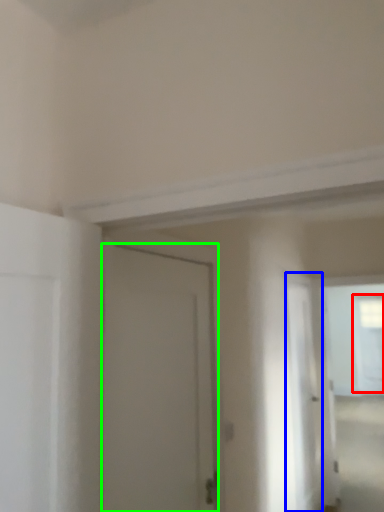
Question: Which is nearer to the window (highlighted by a red box)? screen door (highlighted by a blue box) or door (highlighted by a green box).

Choices:
 (A) screen door
 (B) door

Answer: (A)